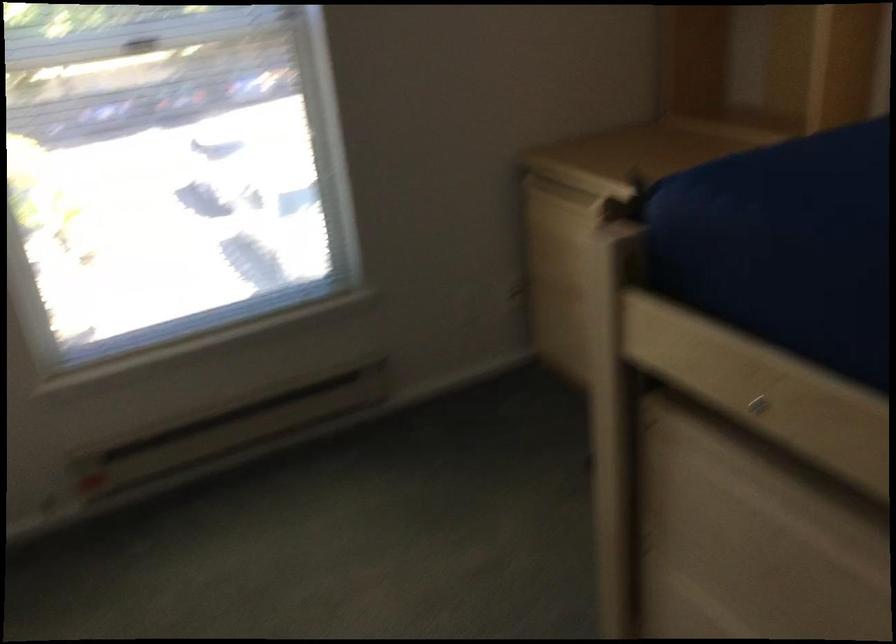
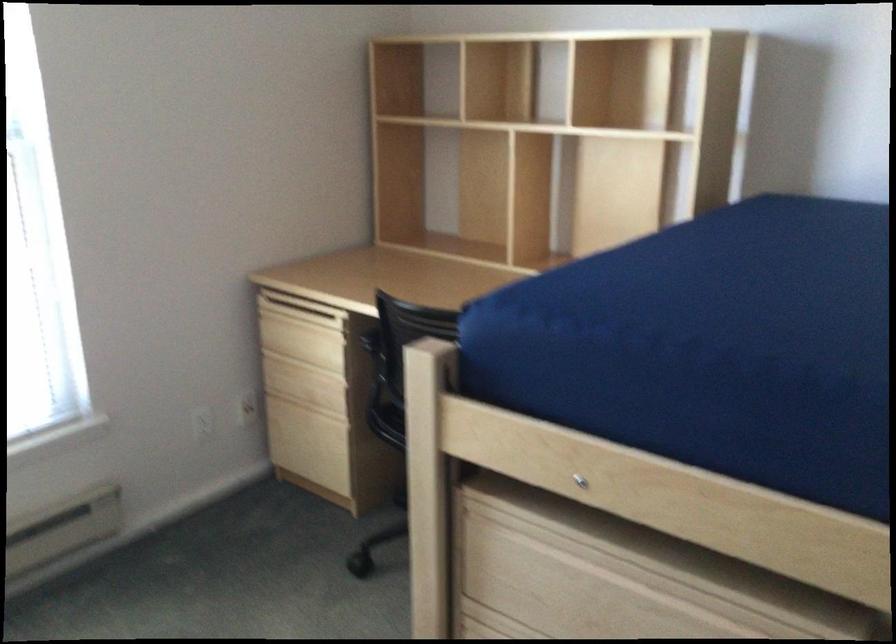
Find the pixel in the second image that matches pixel 506 290 in the first image.

(246, 406)